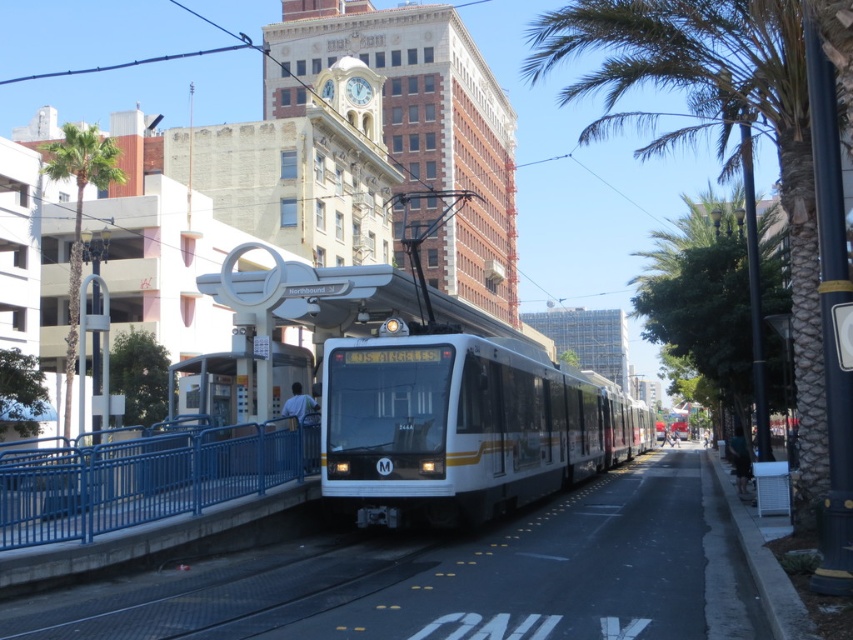
You are a passenger waiting on the blue metal railing at lower left and want to board the white glossy train at center. Which direction should you move to reach the train?

The white glossy train at center is located below the blue metal railing at lower left, so you should move downward towards the train to board it.

You are a photographer trying to capture both the white glossy train at center and the green leafy palm tree at left in a single frame. Based on their sizes, which object should you focus on first to ensure they both fit in the photo?

The white glossy train at center is thinner than the green leafy palm tree at left, so you should focus on the green leafy palm tree at left first to ensure both fit in the photo.